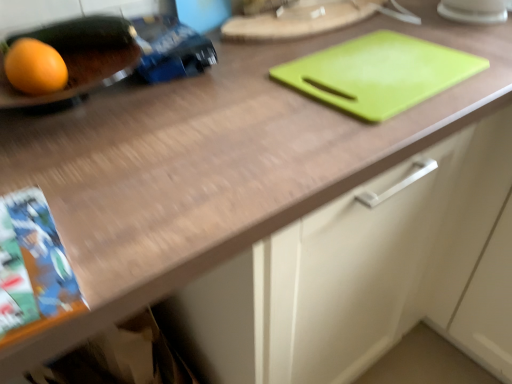
I want to click on blank space situated above green plastic cutting board at upper right, the 3th tray in the left-to-right sequence (from a real-world perspective), so click(x=377, y=64).